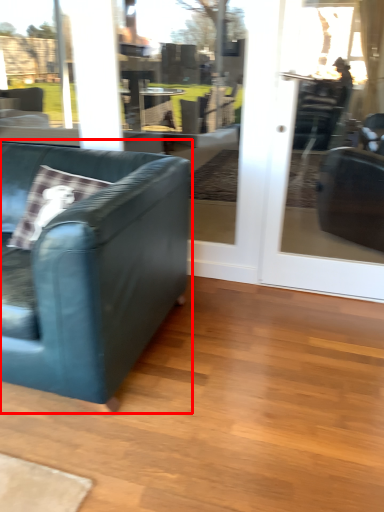
Question: From the image, what is the correct spatial relationship of studio couch (annotated by the red box) in relation to screen door?

Choices:
 (A) left
 (B) right

Answer: (A)